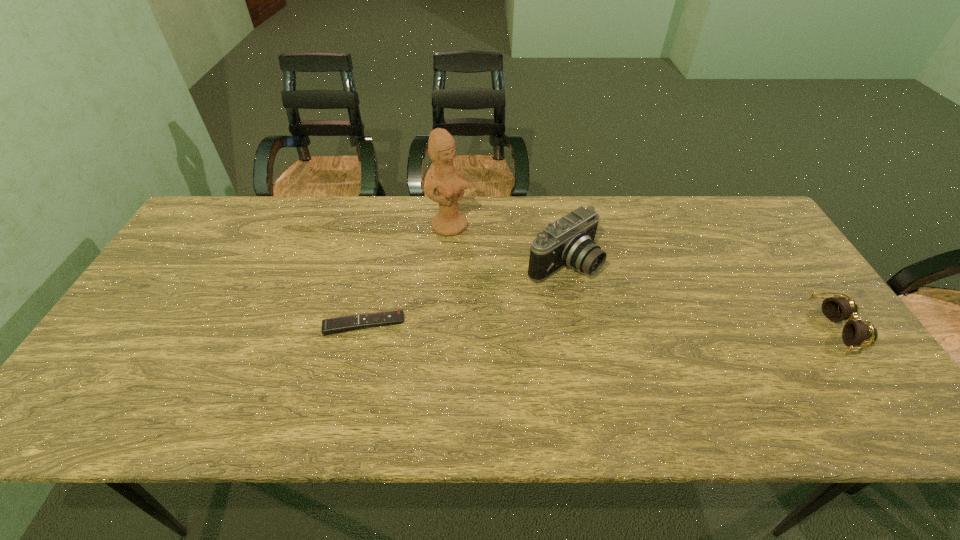
Find the location of a particular element. Image resolution: width=960 pixels, height=540 pixels. free space between the shortest object and the farthest object is located at coordinates (407, 275).

The image size is (960, 540). I want to click on free space between the leftmost object and the third object from left to right, so click(463, 293).

You are a GUI agent. You are given a task and a screenshot of the screen. Output one action in this format:
    pyautogui.click(x=<x>, y=<y>)
    Task: Click on the vacant space that is in between the goggles and the third object from right to left
    
    Given the screenshot: What is the action you would take?
    pyautogui.click(x=643, y=278)

Locate an element on the screen. The image size is (960, 540). free space between the goggles and the camera is located at coordinates (700, 296).

What are the coordinates of `object that stands as the closest to the figurine` in the screenshot? It's located at (569, 241).

The image size is (960, 540). What are the coordinates of `object identified as the second closest to the farthest object` in the screenshot? It's located at (330, 326).

Find the location of a particular element. free spot that satisfies the following two spatial constraints: 1. on the back side of the third nearest object; 2. on the right side of the shortest object is located at coordinates (378, 262).

Locate an element on the screen. Image resolution: width=960 pixels, height=540 pixels. vacant space that satisfies the following two spatial constraints: 1. on the front side of the camera; 2. through the lenses of the rightmost object is located at coordinates (575, 329).

The width and height of the screenshot is (960, 540). Identify the location of free spot that satisfies the following two spatial constraints: 1. on the front side of the second shortest object; 2. through the lenses of the third nearest object. (575, 329).

This screenshot has height=540, width=960. I want to click on vacant region that satisfies the following two spatial constraints: 1. on the back side of the second farthest object; 2. on the right side of the remote control, so click(378, 262).